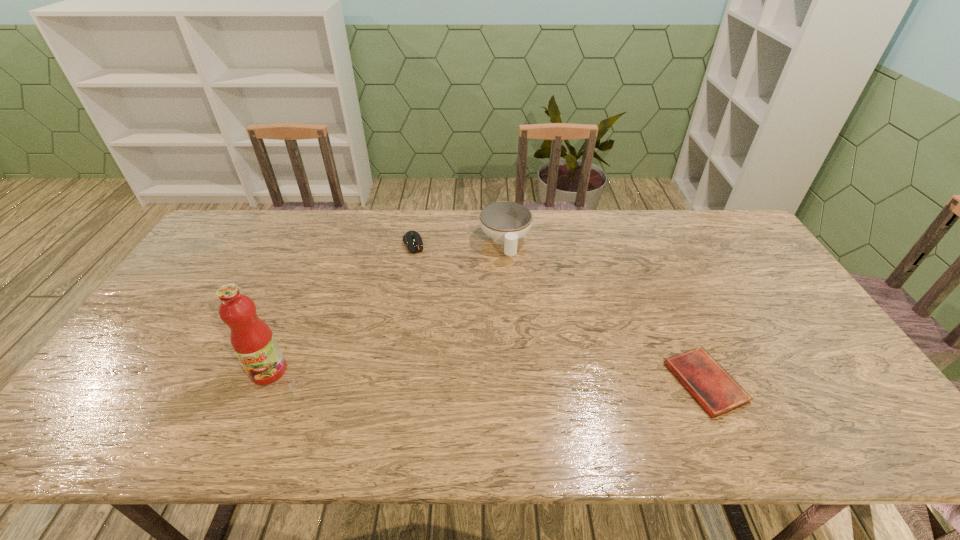
Find the location of `free space at the left edge of the desktop`. free space at the left edge of the desktop is located at coordinates (183, 280).

Locate an element on the screen. The image size is (960, 540). blank space at the right edge of the desktop is located at coordinates (792, 328).

Where is `free space at the far left corner`? free space at the far left corner is located at coordinates pyautogui.click(x=240, y=213).

Find the location of a particular element. The image size is (960, 540). vacant area that lies between the chinaware and the second shortest object is located at coordinates (459, 243).

This screenshot has height=540, width=960. I want to click on blank region between the computer equipment and the diary, so click(559, 313).

Find the location of a particular element. empty space between the third object from right to left and the tallest object is located at coordinates (341, 307).

Where is `empty location between the fruit juice and the rightmost object`? The height and width of the screenshot is (540, 960). empty location between the fruit juice and the rightmost object is located at coordinates (487, 377).

This screenshot has width=960, height=540. In order to click on free space between the shortest object and the second object from right to left in this screenshot , I will do `click(605, 313)`.

In order to click on free space between the tallest object and the diary in this screenshot , I will do `click(487, 377)`.

The image size is (960, 540). I want to click on empty space between the computer equipment and the fruit juice, so click(341, 307).